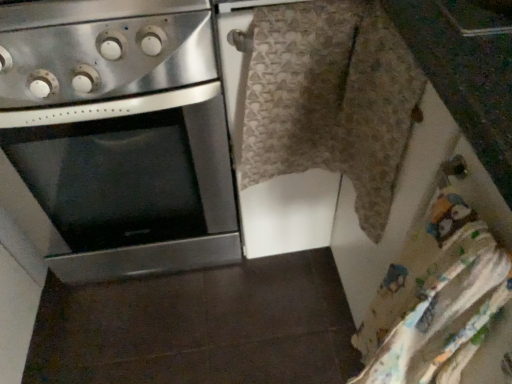
Question: Is stainless steel oven at left located within textured beige blanket at center?

Choices:
 (A) yes
 (B) no

Answer: (B)

Question: Is textured beige blanket at center turned away from stainless steel oven at left?

Choices:
 (A) no
 (B) yes

Answer: (A)

Question: Is textured beige blanket at center at the right side of stainless steel oven at left?

Choices:
 (A) yes
 (B) no

Answer: (A)

Question: Is textured beige blanket at center placed right next to stainless steel oven at left?

Choices:
 (A) no
 (B) yes

Answer: (A)

Question: From the image's perspective, is textured beige blanket at center on stainless steel oven at left?

Choices:
 (A) yes
 (B) no

Answer: (B)

Question: Based on their positions, is textured beige blanket at center located to the left or right of stainless steel oven at left?

Choices:
 (A) right
 (B) left

Answer: (A)

Question: Looking at their shapes, would you say textured beige blanket at center is wider or thinner than stainless steel oven at left?

Choices:
 (A) wide
 (B) thin

Answer: (B)

Question: Would you say textured beige blanket at center is inside or outside stainless steel oven at left?

Choices:
 (A) inside
 (B) outside

Answer: (B)

Question: From the image's perspective, relative to stainless steel oven at left, is textured beige blanket at center above or below?

Choices:
 (A) above
 (B) below

Answer: (B)

Question: In terms of height, does stainless steel oven at left look taller or shorter compared to textured beige blanket at center?

Choices:
 (A) tall
 (B) short

Answer: (A)

Question: Looking at their shapes, would you say stainless steel oven at left is wider or thinner than textured beige blanket at center?

Choices:
 (A) wide
 (B) thin

Answer: (A)

Question: From a real-world perspective, is stainless steel oven at left positioned above or below textured beige blanket at center?

Choices:
 (A) above
 (B) below

Answer: (B)

Question: In terms of size, does stainless steel oven at left appear bigger or smaller than textured beige blanket at center?

Choices:
 (A) small
 (B) big

Answer: (B)

Question: In terms of width, does stainless steel oven at left look wider or thinner when compared to stainless steel gas stove at upper left?

Choices:
 (A) thin
 (B) wide

Answer: (B)

Question: In the image, is stainless steel oven at left on the left side or the right side of stainless steel gas stove at upper left?

Choices:
 (A) right
 (B) left

Answer: (B)